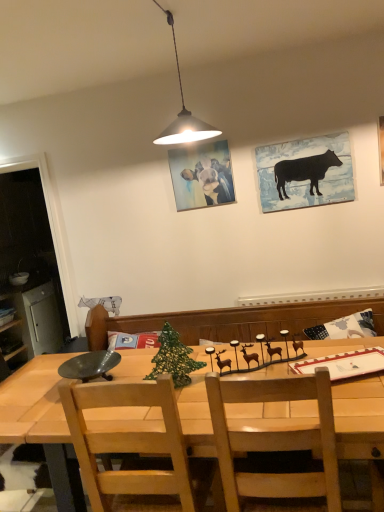
In order to click on wooden table at center in this screenshot , I will do `click(42, 423)`.

Describe the element at coordinates (37, 317) in the screenshot. I see `brushed metal cabinet at left` at that location.

The width and height of the screenshot is (384, 512). Find the location of `matte oil painting of cow at center, which ranks as the second picture frame in right-to-left order`. matte oil painting of cow at center, which ranks as the second picture frame in right-to-left order is located at coordinates (202, 176).

Measure the distance between green mesh christmas tree at center and camera.

The depth of green mesh christmas tree at center is 1.71 meters.

What is the approximate width of light brown wooden chair at center?

The width of light brown wooden chair at center is 18.46 inches.

Locate an element on the screen. black matte cow at upper right, the 2th picture frame in the left-to-right sequence is located at coordinates (305, 172).

Between black matte cow at upper right, which is the first picture frame in right-to-left order, and light brown wooden chair at center, which one appears on the right side from the viewer's perspective?

From the viewer's perspective, black matte cow at upper right, which is the first picture frame in right-to-left order, appears more on the right side.

Based on the photo, from a real-world perspective, is black matte cow at upper right, the 2th picture frame in the left-to-right sequence, above or below light brown wooden chair at center?

From a real-world perspective, black matte cow at upper right, the 2th picture frame in the left-to-right sequence, is physically above light brown wooden chair at center.

From the image's perspective, does black matte cow at upper right, which is the first picture frame in right-to-left order, appear higher than light brown wooden chair at center?

Yes, from the image's perspective, black matte cow at upper right, which is the first picture frame in right-to-left order, is on top of light brown wooden chair at center.

The height and width of the screenshot is (512, 384). What are the coordinates of `chair on the left of black matte cow at upper right, which is the first picture frame in right-to-left order` in the screenshot? It's located at click(129, 447).

Which object is positioned more to the left, black matte cow at upper right, which is the first picture frame in right-to-left order, or brushed metal cabinet at left?

From the viewer's perspective, brushed metal cabinet at left appears more on the left side.

Considering the positions of points (270, 162) and (30, 338), is point (270, 162) closer to camera compared to point (30, 338)?

Yes, it is.

Which of these two, black matte cow at upper right, which is the first picture frame in right-to-left order, or brushed metal cabinet at left, stands taller?

With more height is brushed metal cabinet at left.

Which is in front, black matte cow at upper right, the 2th picture frame in the left-to-right sequence, or brushed metal cabinet at left?

black matte cow at upper right, the 2th picture frame in the left-to-right sequence, is closer to the camera.

Considering the points (176, 375) and (313, 162), which point is in front, point (176, 375) or point (313, 162)?

Positioned in front is point (176, 375).

Is green mesh christmas tree at center situated inside black matte cow at upper right, which is the first picture frame in right-to-left order, or outside?

The correct answer is: outside.

From the image's perspective, which is below, green mesh christmas tree at center or black matte cow at upper right, which is the first picture frame in right-to-left order?

green mesh christmas tree at center, from the image's perspective.

Are green mesh christmas tree at center and black matte cow at upper right, which is the first picture frame in right-to-left order, far apart?

Yes, green mesh christmas tree at center and black matte cow at upper right, which is the first picture frame in right-to-left order, are quite far apart.

Is wooden table at center oriented away from light brown wooden chair at center?

Yes, light brown wooden chair at center is at the back of wooden table at center.

Does wooden table at center lie behind light brown wooden chair at center?

No, wooden table at center is closer to the camera.

From the picture: From a real-world perspective, between wooden table at center and light brown wooden chair at center, who is vertically lower?

wooden table at center.

In the scene shown: Between wooden table at center and light brown wooden chair at center, which one has smaller width?

Thinner between the two is light brown wooden chair at center.

Which of these two, wooden table at center or black matte cow at upper right, which is the first picture frame in right-to-left order, is wider?

Wider between the two is wooden table at center.

Does wooden table at center turn towards black matte cow at upper right, which is the first picture frame in right-to-left order?

No, wooden table at center is not aimed at black matte cow at upper right, which is the first picture frame in right-to-left order.

From the image's perspective, is wooden table at center over black matte cow at upper right, which is the first picture frame in right-to-left order?

No, from the image's perspective, wooden table at center is not over black matte cow at upper right, which is the first picture frame in right-to-left order.

Which object is positioned more to the left, wooden table at center or black matte cow at upper right, which is the first picture frame in right-to-left order?

From the viewer's perspective, wooden table at center appears more on the left side.

From the image's perspective, who appears lower, matte oil painting of cow at center, which ranks as the second picture frame in right-to-left order, or black matte cow at upper right, which is the first picture frame in right-to-left order?

black matte cow at upper right, which is the first picture frame in right-to-left order.

Is matte oil painting of cow at center, the 1th picture frame from the left, smaller than black matte cow at upper right, which is the first picture frame in right-to-left order?

Yes.

From a real-world perspective, between matte oil painting of cow at center, the 1th picture frame from the left, and black matte cow at upper right, the 2th picture frame in the left-to-right sequence, who is vertically lower?

black matte cow at upper right, the 2th picture frame in the left-to-right sequence, is physically lower.

Which object is positioned more to the left, matte oil painting of cow at center, which ranks as the second picture frame in right-to-left order, or black matte cow at upper right, the 2th picture frame in the left-to-right sequence?

matte oil painting of cow at center, which ranks as the second picture frame in right-to-left order, is more to the left.

Considering the positions of objects matte oil painting of cow at center, which ranks as the second picture frame in right-to-left order, and brushed metal cabinet at left in the image provided, who is more to the left, matte oil painting of cow at center, which ranks as the second picture frame in right-to-left order, or brushed metal cabinet at left?

Positioned to the left is brushed metal cabinet at left.

Is matte oil painting of cow at center, the 1th picture frame from the left, far away from brushed metal cabinet at left?

Absolutely, matte oil painting of cow at center, the 1th picture frame from the left, is distant from brushed metal cabinet at left.

Is matte oil painting of cow at center, the 1th picture frame from the left, bigger or smaller than brushed metal cabinet at left?

Considering their sizes, matte oil painting of cow at center, the 1th picture frame from the left, takes up less space than brushed metal cabinet at left.

Which is behind, matte oil painting of cow at center, which ranks as the second picture frame in right-to-left order, or brushed metal cabinet at left?

brushed metal cabinet at left is behind.

Where is `the 1st picture frame above the light brown wooden chair at center (from the image's perspective)`? The height and width of the screenshot is (512, 384). the 1st picture frame above the light brown wooden chair at center (from the image's perspective) is located at coordinates (305, 172).

Image resolution: width=384 pixels, height=512 pixels. Identify the location of cabinetry that is on the left side of black matte cow at upper right, which is the first picture frame in right-to-left order. (37, 317).

Estimate the real-world distances between objects in this image. Which object is closer to matte oil painting of cow at center, the 1th picture frame from the left, wooden table at center or green mesh christmas tree at center?

The object closer to matte oil painting of cow at center, the 1th picture frame from the left, is green mesh christmas tree at center.

When comparing their distances from black matte cow at upper right, the 2th picture frame in the left-to-right sequence, does matte oil painting of cow at center, which ranks as the second picture frame in right-to-left order, or light brown wooden chair at center seem further?

Based on the image, light brown wooden chair at center appears to be further to black matte cow at upper right, the 2th picture frame in the left-to-right sequence.

When comparing their distances from wooden table at center, does light brown wooden chair at center or black matte cow at upper right, which is the first picture frame in right-to-left order, seem closer?

Based on the image, light brown wooden chair at center appears to be nearer to wooden table at center.

Which object lies further to the anchor point matte oil painting of cow at center, which ranks as the second picture frame in right-to-left order, green mesh christmas tree at center or black matte cow at upper right, the 2th picture frame in the left-to-right sequence?

green mesh christmas tree at center is positioned further to the anchor matte oil painting of cow at center, which ranks as the second picture frame in right-to-left order.

Based on their spatial positions, is wooden table at center or light brown wooden chair at center further from brushed metal cabinet at left?

light brown wooden chair at center is positioned further to the anchor brushed metal cabinet at left.

Which object lies nearer to the anchor point light brown wooden chair at center, wooden table at center or brushed metal cabinet at left?

Based on the image, wooden table at center appears to be nearer to light brown wooden chair at center.

Considering their positions, is brushed metal cabinet at left positioned further to green mesh christmas tree at center than wooden table at center?

brushed metal cabinet at left is further to green mesh christmas tree at center.

Based on their spatial positions, is wooden table at center or brushed metal cabinet at left closer to matte oil painting of cow at center, which ranks as the second picture frame in right-to-left order?

wooden table at center is closer to matte oil painting of cow at center, which ranks as the second picture frame in right-to-left order.

In order to click on chair between brushed metal cabinet at left and black matte cow at upper right, which is the first picture frame in right-to-left order, from left to right in this screenshot , I will do `click(129, 447)`.

You are a GUI agent. You are given a task and a screenshot of the screen. Output one action in this format:
    pyautogui.click(x=<x>, y=<y>)
    Task: Click on the christmas tree located between brushed metal cabinet at left and black matte cow at upper right, the 2th picture frame in the left-to-right sequence, in the left-right direction
    
    Given the screenshot: What is the action you would take?
    pyautogui.click(x=173, y=358)

Identify the location of picture frame between matte oil painting of cow at center, which ranks as the second picture frame in right-to-left order, and light brown wooden chair at center, in the vertical direction. (305, 172).

This screenshot has height=512, width=384. Find the location of `christmas tree between black matte cow at upper right, the 2th picture frame in the left-to-right sequence, and wooden table at center vertically`. christmas tree between black matte cow at upper right, the 2th picture frame in the left-to-right sequence, and wooden table at center vertically is located at coordinates (173, 358).